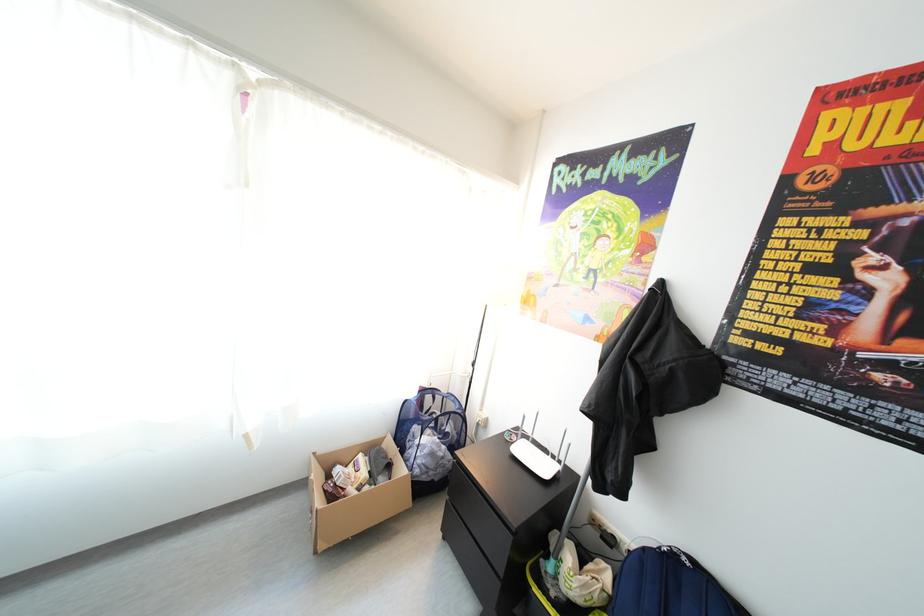
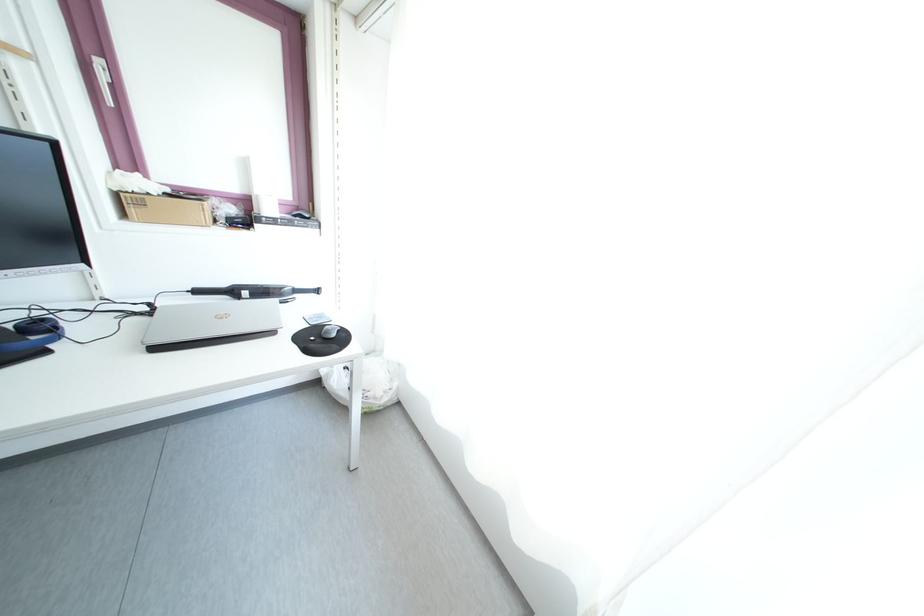
Question: The camera is either moving clockwise (left) or counter-clockwise (right) around the object. The first image is from the beginning of the video and the second image is from the end. Is the camera moving left or right when shooting the video?

Choices:
 (A) Left
 (B) Right

Answer: (B)